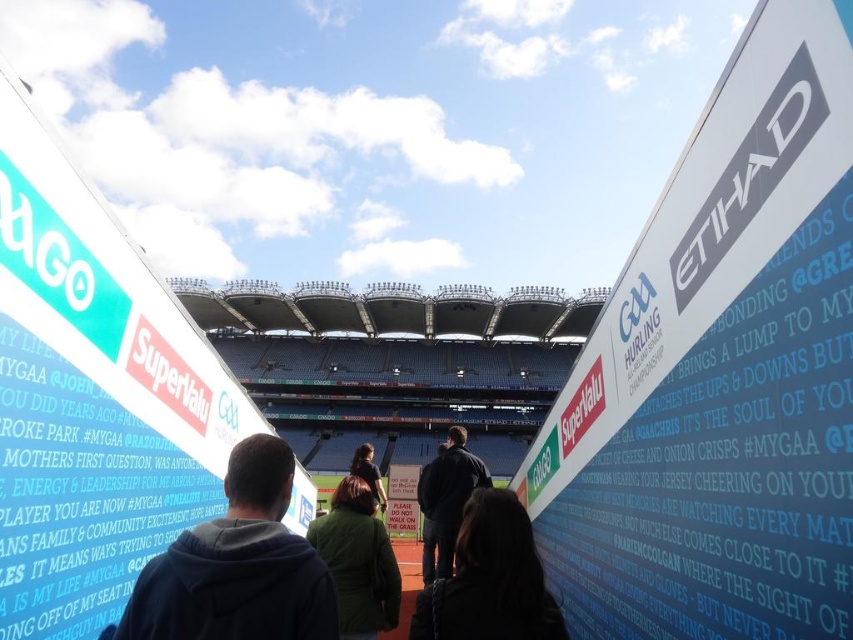
You are a spectator entering the stadium and notice the white plastic sign at right and the dark green jacket at center. Which object is positioned higher in the scene?

The white plastic sign at right is above the dark green jacket at center, so it is positioned higher.

You are an event organizer trying to place a new banner that is 1.2 meters wide between the white plastic sign at right and the dark green jacket at center. Based on their widths, will the new banner fit between them?

The white plastic sign at right is narrower than the dark green jacket at center, but since the new banner is 1.2 meters wide, we need to know the exact width of the space between them. However, the description only states the sign is less wide than the jacket, not the distance between them. Therefore, it is impossible to determine if the banner will fit without additional information.